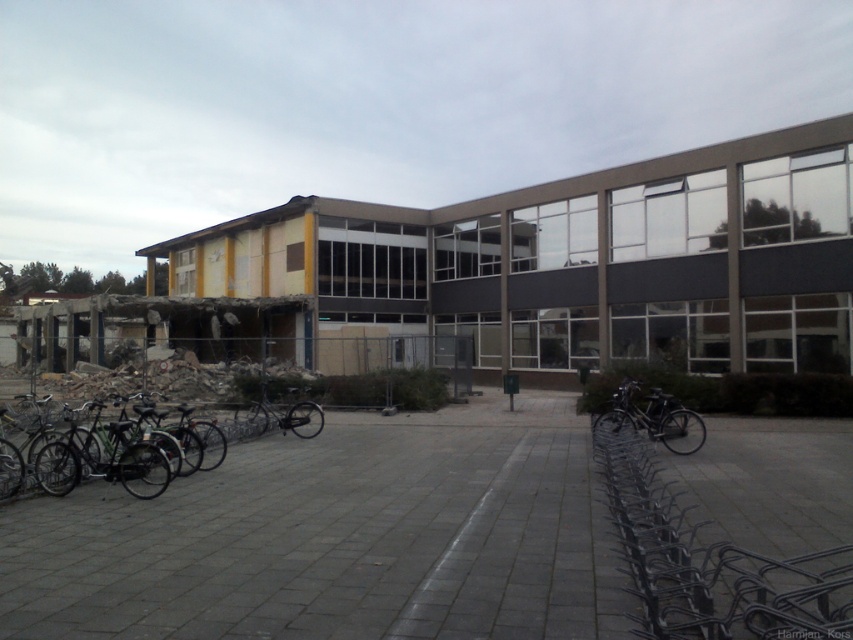
Who is positioned more to the left, shiny black bicycle at left or black matte bicycle at lower right?

From the viewer's perspective, shiny black bicycle at left appears more on the left side.

Consider the image. Who is more forward, (68, 444) or (668, 445)?

Point (68, 444) is more forward.

Identify the location of shiny black bicycle at left. This screenshot has width=853, height=640. [103, 461].

From the picture: Who is taller, metallic silver bike rack at lower right or black matte bicycle at lower right?

Standing taller between the two is black matte bicycle at lower right.

How distant is metallic silver bike rack at lower right from black matte bicycle at lower right?

metallic silver bike rack at lower right and black matte bicycle at lower right are 8.56 meters apart.

Who is more forward, (648, 502) or (672, 401)?

Point (648, 502) is more forward.

Locate an element on the screen. The image size is (853, 640). metallic silver bike rack at lower right is located at coordinates (711, 561).

Between metallic silver bike rack at lower right and shiny black bicycle at left, which one is positioned lower?

metallic silver bike rack at lower right

Is metallic silver bike rack at lower right shorter than shiny black bicycle at left?

Yes.

Between point (758, 589) and point (78, 465), which one is positioned behind?

Positioned behind is point (78, 465).

Locate an element on the screen. The image size is (853, 640). metallic silver bike rack at lower right is located at coordinates (711, 561).